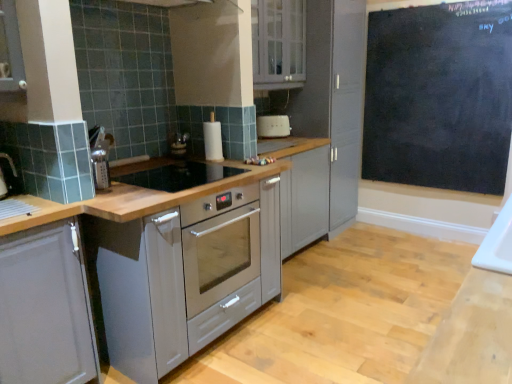
Question: Choose the correct answer: Is white plastic toaster at center inside matte gray cabinet at left, the 2th cabinetry when ordered from top to bottom, or outside it?

Choices:
 (A) outside
 (B) inside

Answer: (A)

Question: Is white plastic toaster at center wider or thinner than matte gray cabinet at left, which ranks as the 2th cabinetry in right-to-left order?

Choices:
 (A) thin
 (B) wide

Answer: (A)

Question: Estimate the real-world distances between objects in this image. Which object is farther from the white plastic toaster at center?

Choices:
 (A) black glass gas stove at center
 (B) white glossy cabinet at upper center, the 2th cabinetry from the bottom
 (C) black chalkboard at upper right
 (D) matte gray cabinet at left, which ranks as the 2th cabinetry in right-to-left order

Answer: (D)

Question: Estimate the real-world distances between objects in this image. Which object is farther from the black glass gas stove at center?

Choices:
 (A) white glossy cabinet at upper center, which is the 1th cabinetry in top-to-bottom order
 (B) white plastic toaster at center
 (C) matte gray cabinet at left, which ranks as the second cabinetry in back-to-front order
 (D) black chalkboard at upper right

Answer: (D)